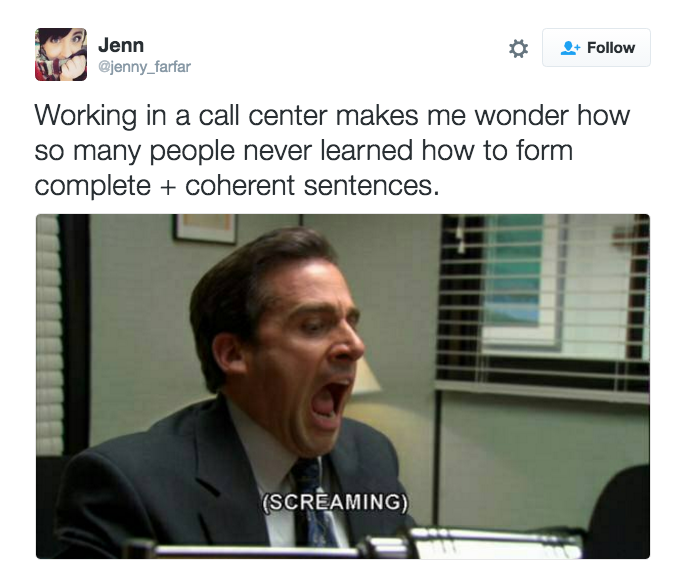
Find the location of `window blinds`. window blinds is located at coordinates (62, 317), (55, 348), (55, 398), (506, 242), (506, 317), (516, 372), (534, 395).